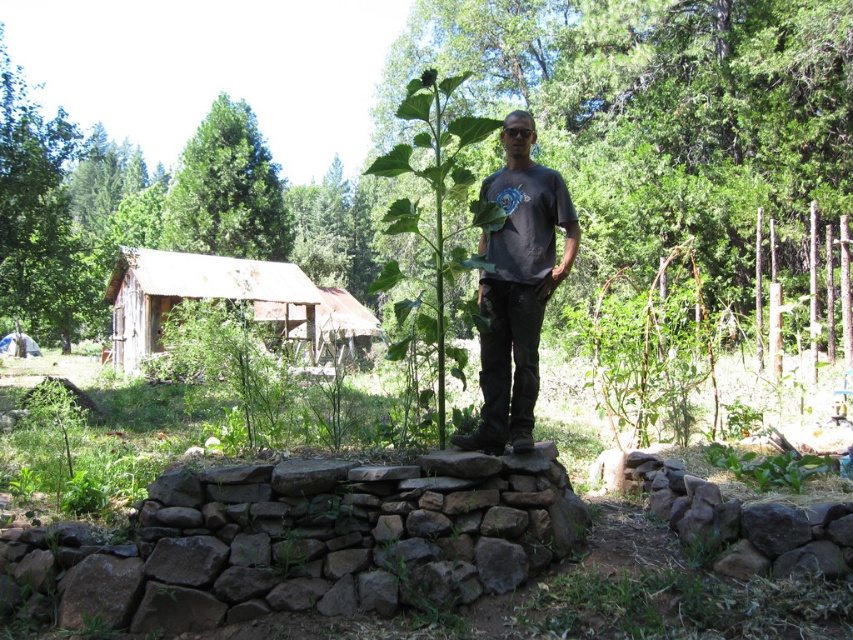
Question: Can you confirm if dark gray t-shirt at center is positioned above green leafy tree at upper left?

Choices:
 (A) yes
 (B) no

Answer: (B)

Question: Can you confirm if dark gray t-shirt at center is positioned to the right of rusty wood cabin at left?

Choices:
 (A) yes
 (B) no

Answer: (A)

Question: Which object is the farthest from the dark gray t-shirt at center?

Choices:
 (A) green leafy tree at upper left
 (B) rusty wood cabin at left

Answer: (A)

Question: Which object is positioned closest to the dark gray t-shirt at center?

Choices:
 (A) rusty wood cabin at left
 (B) green leafy tree at upper left

Answer: (A)

Question: Among these points, which one is farthest from the camera?

Choices:
 (A) (196, 294)
 (B) (235, 211)
 (C) (526, 422)

Answer: (B)

Question: Can you confirm if green leafy tree at upper left is thinner than rusty wood cabin at left?

Choices:
 (A) yes
 (B) no

Answer: (B)